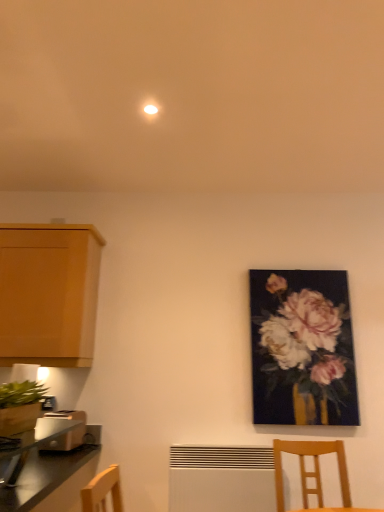
Question: From a real-world perspective, is metallic silver toaster at lower left physically above light brown plastic toaster at lower left?

Choices:
 (A) yes
 (B) no

Answer: (A)

Question: Considering the relative sizes of metallic silver toaster at lower left and light brown plastic toaster at lower left in the image provided, is metallic silver toaster at lower left shorter than light brown plastic toaster at lower left?

Choices:
 (A) yes
 (B) no

Answer: (B)

Question: Is metallic silver toaster at lower left outside light brown plastic toaster at lower left?

Choices:
 (A) yes
 (B) no

Answer: (A)

Question: From a real-world perspective, is metallic silver toaster at lower left located beneath light brown plastic toaster at lower left?

Choices:
 (A) no
 (B) yes

Answer: (A)

Question: Can you confirm if metallic silver toaster at lower left is bigger than light brown plastic toaster at lower left?

Choices:
 (A) yes
 (B) no

Answer: (A)

Question: In the image, is matte floral painting at right on the left side or the right side of metallic silver toaster at lower left?

Choices:
 (A) right
 (B) left

Answer: (A)

Question: Is matte floral painting at right bigger or smaller than metallic silver toaster at lower left?

Choices:
 (A) small
 (B) big

Answer: (B)

Question: From a real-world perspective, is matte floral painting at right positioned above or below metallic silver toaster at lower left?

Choices:
 (A) above
 (B) below

Answer: (A)

Question: Considering the positions of matte floral painting at right and metallic silver toaster at lower left in the image, is matte floral painting at right taller or shorter than metallic silver toaster at lower left?

Choices:
 (A) tall
 (B) short

Answer: (A)

Question: From the image's perspective, is white matte radiator at lower center positioned above or below metallic silver toaster at lower left?

Choices:
 (A) above
 (B) below

Answer: (B)

Question: Relative to metallic silver toaster at lower left, is white matte radiator at lower center in front or behind?

Choices:
 (A) behind
 (B) front

Answer: (A)

Question: Is white matte radiator at lower center situated inside metallic silver toaster at lower left or outside?

Choices:
 (A) outside
 (B) inside

Answer: (A)

Question: Is point (231, 480) positioned closer to the camera than point (36, 450)?

Choices:
 (A) farther
 (B) closer

Answer: (A)

Question: From a real-world perspective, is light brown plastic toaster at lower left positioned above or below wooden chair at lower right?

Choices:
 (A) below
 (B) above

Answer: (B)

Question: Considering the positions of point (69, 437) and point (317, 458), is point (69, 437) closer or farther from the camera than point (317, 458)?

Choices:
 (A) closer
 (B) farther

Answer: (B)